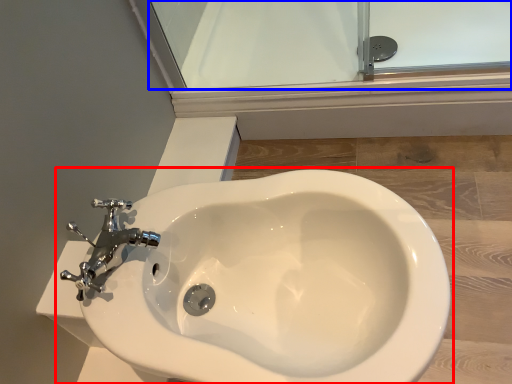
Question: Which point is further to the camera, toilet (highlighted by a red box) or glass door (highlighted by a blue box)?

Choices:
 (A) toilet
 (B) glass door

Answer: (B)